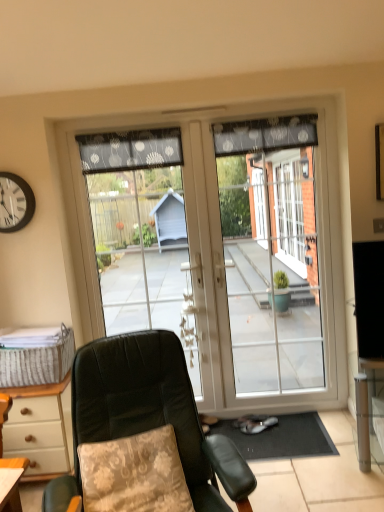
I want to click on vacant area on top of transparent glass door at center (from a real-world perspective), so click(253, 111).